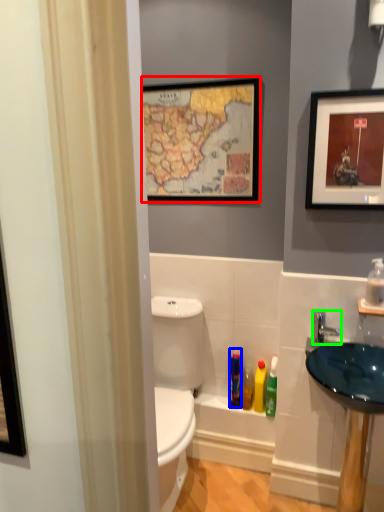
Question: Considering the real-world distances, which object is closest to picture frame (highlighted by a red box)? toiletry (highlighted by a blue box) or tap (highlighted by a green box).

Choices:
 (A) toiletry
 (B) tap

Answer: (B)